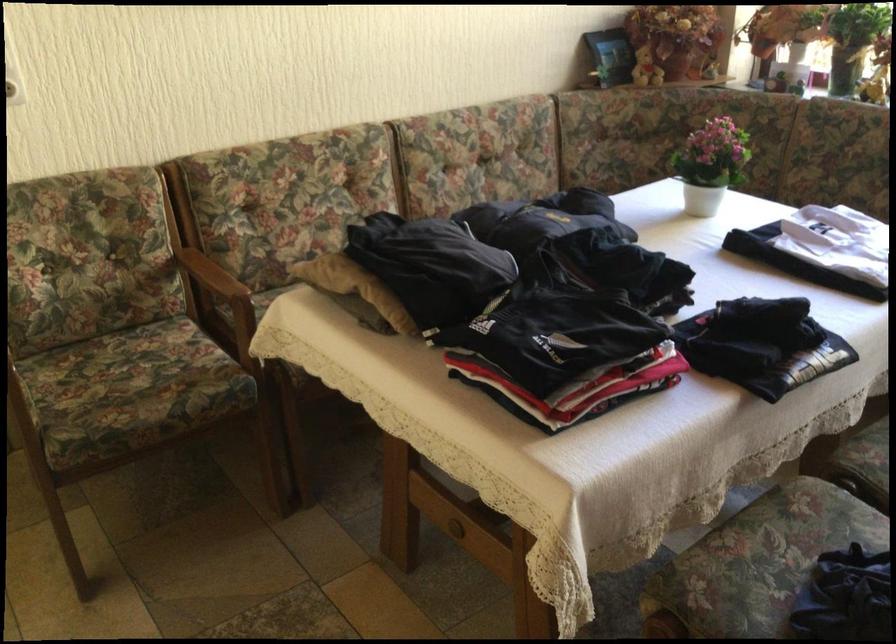
Where would you insert the white electrical outlet? Please return your answer as a coordinate pair (x, y).

(12, 73)